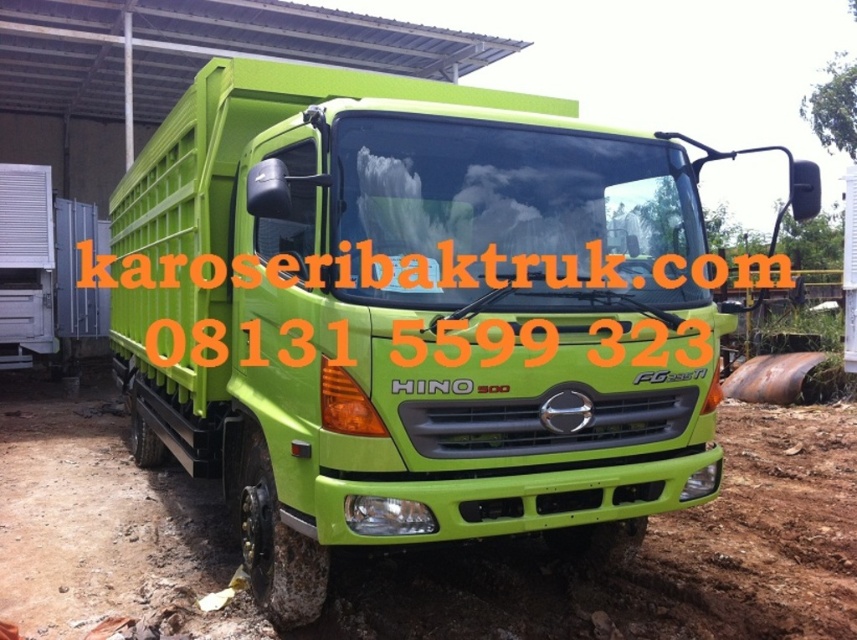
Does point (25, 388) lie in front of point (40, 342)?

No.

Can you confirm if green matte dirt field at center is shorter than green matte truck at left?

Yes.

What do you see at coordinates (649, 557) in the screenshot? The height and width of the screenshot is (640, 857). I see `green matte dirt field at center` at bounding box center [649, 557].

Where is `green matte dirt field at center`? green matte dirt field at center is located at coordinates (649, 557).